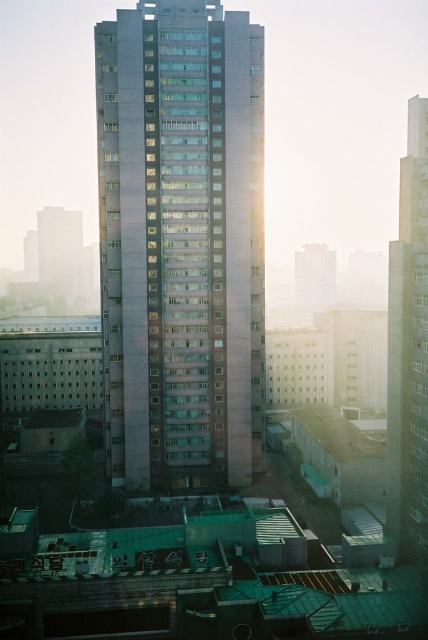
You are a GUI agent. You are given a task and a screenshot of the screen. Output one action in this format:
    pyautogui.click(x=<x>, y=<y>)
    Task: Click on the smooth gray building at center
    This screenshot has height=640, width=428.
    Given the screenshot: What is the action you would take?
    pyautogui.click(x=181, y=243)

Can you confirm if smooth gray building at center is positioned to the left of metallic glass skyscraper at right?

Yes, smooth gray building at center is to the left of metallic glass skyscraper at right.

Locate an element on the screen. smooth gray building at center is located at coordinates (181, 243).